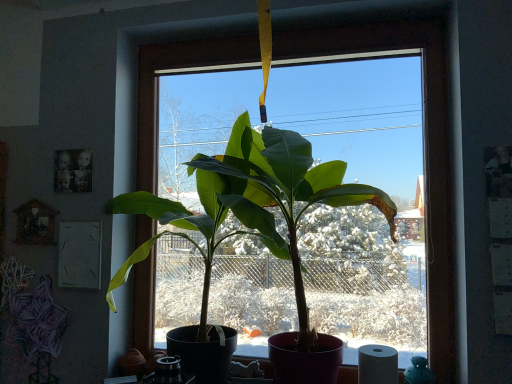
Question: Is green matte plant at center not within white matte toilet paper at lower right?

Choices:
 (A) no
 (B) yes

Answer: (B)

Question: From a real-world perspective, is green matte plant at center under white matte toilet paper at lower right?

Choices:
 (A) no
 (B) yes

Answer: (A)

Question: From a real-world perspective, is green matte plant at center positioned over white matte toilet paper at lower right based on gravity?

Choices:
 (A) yes
 (B) no

Answer: (A)

Question: Does green matte plant at center have a lesser width compared to white matte toilet paper at lower right?

Choices:
 (A) no
 (B) yes

Answer: (A)

Question: Does green matte plant at center come in front of white matte toilet paper at lower right?

Choices:
 (A) no
 (B) yes

Answer: (B)

Question: Considering the relative sizes of green matte plant at center and white matte toilet paper at lower right in the image provided, is green matte plant at center smaller than white matte toilet paper at lower right?

Choices:
 (A) no
 (B) yes

Answer: (A)

Question: Considering the relative sizes of white matte toilet paper at lower right and green matte plant at center in the image provided, is white matte toilet paper at lower right taller than green matte plant at center?

Choices:
 (A) no
 (B) yes

Answer: (A)

Question: Can you confirm if white matte toilet paper at lower right is shorter than green matte plant at center?

Choices:
 (A) no
 (B) yes

Answer: (B)

Question: Would you say white matte toilet paper at lower right is outside green matte plant at center?

Choices:
 (A) yes
 (B) no

Answer: (B)

Question: Is white matte toilet paper at lower right looking in the opposite direction of green matte plant at center?

Choices:
 (A) no
 (B) yes

Answer: (B)

Question: Does white matte toilet paper at lower right have a lesser width compared to green matte plant at center?

Choices:
 (A) no
 (B) yes

Answer: (B)

Question: Does white matte toilet paper at lower right have a smaller size compared to green matte plant at center?

Choices:
 (A) yes
 (B) no

Answer: (A)

Question: From the image's perspective, is green matte plant at center located above or below white matte toilet paper at lower right?

Choices:
 (A) above
 (B) below

Answer: (A)